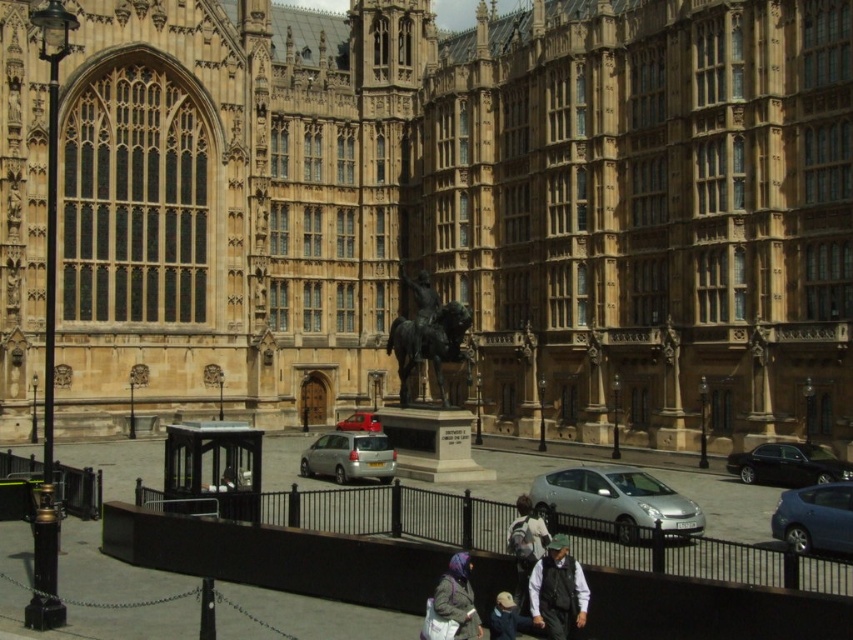
Which is below, silver metallic car at center or bronze statue at center?

Positioned lower is silver metallic car at center.

Does silver metallic car at center lie in front of bronze statue at center?

Yes, it is.

Who is more forward, (561, 481) or (415, 356)?

Point (561, 481) is in front.

Locate an element on the screen. Image resolution: width=853 pixels, height=640 pixels. silver metallic car at center is located at coordinates (616, 502).

Does blue metallic hatchback at lower right appear on the left side of satin silver car at center?

Incorrect, blue metallic hatchback at lower right is not on the left side of satin silver car at center.

Is point (833, 544) in front of point (392, 468)?

Yes, point (833, 544) is closer to viewer.

Locate an element on the screen. Image resolution: width=853 pixels, height=640 pixels. blue metallic hatchback at lower right is located at coordinates (815, 518).

Can you confirm if dark gray fabric jacket at lower center is wider than light brown leather jacket at lower center?

Indeed, dark gray fabric jacket at lower center has a greater width compared to light brown leather jacket at lower center.

Is dark gray fabric jacket at lower center positioned before light brown leather jacket at lower center?

No, dark gray fabric jacket at lower center is behind light brown leather jacket at lower center.

Image resolution: width=853 pixels, height=640 pixels. What do you see at coordinates (556, 589) in the screenshot? I see `dark gray fabric jacket at lower center` at bounding box center [556, 589].

The width and height of the screenshot is (853, 640). Identify the location of dark gray fabric jacket at lower center. (556, 589).